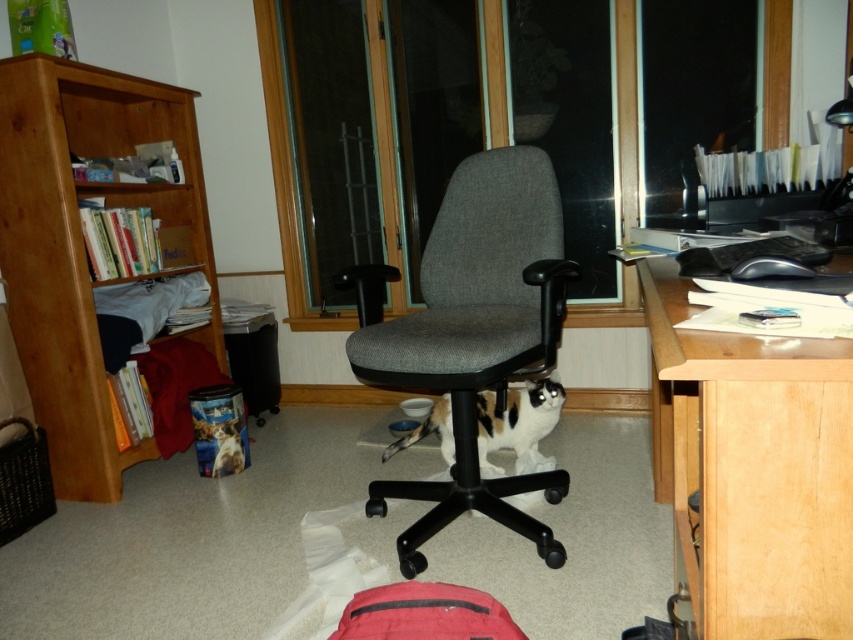
From the picture: Who is positioned more to the left, light brown wood computer desk at right or gray fabric swivel chair at center?

Result: Positioned to the left is gray fabric swivel chair at center.

Where is `light brown wood computer desk at right`? The image size is (853, 640). light brown wood computer desk at right is located at coordinates (752, 468).

Can you confirm if gray fabric swivel chair at center is wider than calico fur cat at center?

Indeed, gray fabric swivel chair at center has a greater width compared to calico fur cat at center.

Does gray fabric swivel chair at center have a lesser height compared to calico fur cat at center?

No.

Which is behind, point (445, 260) or point (524, 400)?

Positioned behind is point (524, 400).

You are a GUI agent. You are given a task and a screenshot of the screen. Output one action in this format:
    pyautogui.click(x=<x>, y=<y>)
    Task: Click on the gray fabric swivel chair at center
    
    Given the screenshot: What is the action you would take?
    pyautogui.click(x=471, y=332)

Can you confirm if light brown wood computer desk at right is smaller than light brown wood bookshelf at left?

Yes, light brown wood computer desk at right is smaller than light brown wood bookshelf at left.

Which is more to the right, light brown wood computer desk at right or light brown wood bookshelf at left?

From the viewer's perspective, light brown wood computer desk at right appears more on the right side.

Who is more distant from viewer, (676, 410) or (187, 189)?

Point (187, 189)

At what (x,y) coordinates should I click in order to perform the action: click on light brown wood computer desk at right. Please return your answer as a coordinate pair (x, y). This screenshot has height=640, width=853. Looking at the image, I should click on (752, 468).